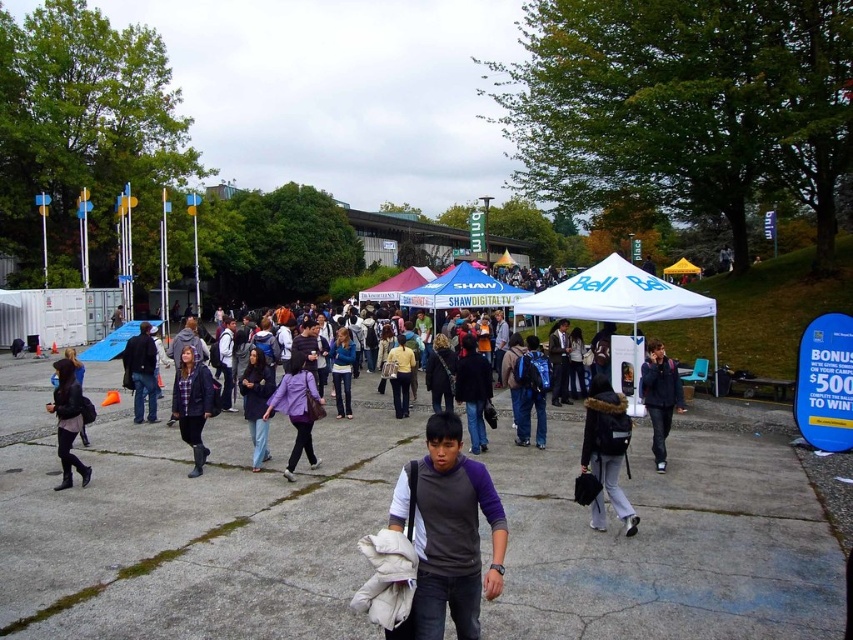
Question: Among these objects, which one is nearest to the camera?

Choices:
 (A) gray fabric backpack at center
 (B) blue denim jeans at center
 (C) dark gray jacket at center
 (D) white tent at center

Answer: (A)

Question: Is denim jacket at center to the left of white tent at center from the viewer's perspective?

Choices:
 (A) no
 (B) yes

Answer: (B)

Question: Which point is closer to the camera?

Choices:
 (A) white fabric tent at center
 (B) white tent at center
 (C) purple matte jacket at center
 (D) yellow matte shirt at center

Answer: (C)

Question: Which object is farther from the camera taking this photo?

Choices:
 (A) denim jacket at center
 (B) dark gray fleece jacket at center

Answer: (A)

Question: From the image, what is the correct spatial relationship of dark gray fleece jacket at center in relation to yellow matte shirt at center?

Choices:
 (A) right
 (B) left

Answer: (A)

Question: Is matte black jacket at left to the left of yellow matte shirt at center from the viewer's perspective?

Choices:
 (A) yes
 (B) no

Answer: (A)